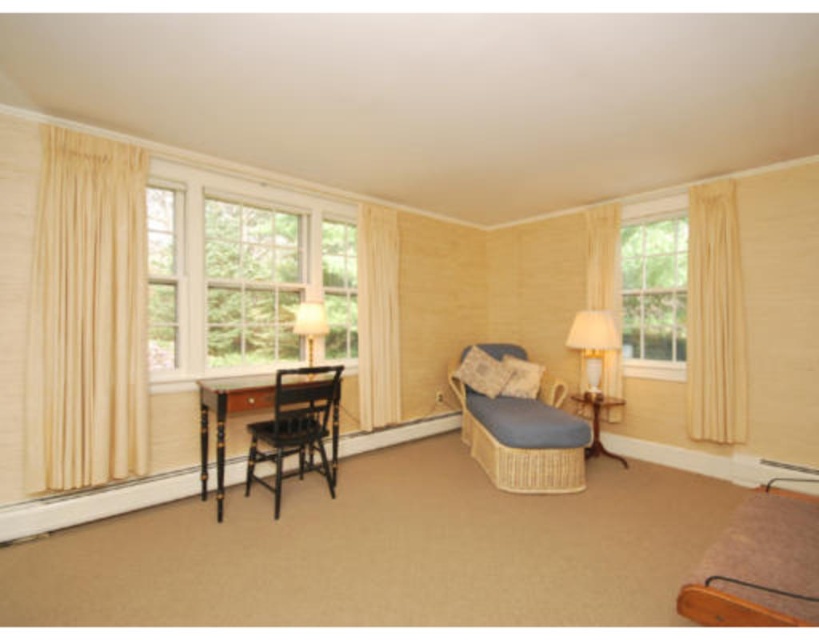
Is beige fabric curtain at right bigger than white glossy lampshade at upper center?

Yes.

Is beige fabric curtain at right to the left of white glossy lampshade at upper center from the viewer's perspective?

Incorrect, beige fabric curtain at right is not on the left side of white glossy lampshade at upper center.

At what (x,y) coordinates should I click in order to perform the action: click on beige fabric curtain at right. Please return your answer as a coordinate pair (x, y). This screenshot has height=640, width=819. Looking at the image, I should click on (713, 316).

Can you confirm if white wood window at center is positioned above white glossy table lamp at right?

Indeed, white wood window at center is positioned over white glossy table lamp at right.

Can you confirm if white wood window at center is positioned to the left of white glossy table lamp at right?

Correct, you'll find white wood window at center to the left of white glossy table lamp at right.

Between point (170, 362) and point (609, 314), which one is positioned in front?

Point (170, 362)

Identify the location of white wood window at center. pyautogui.click(x=242, y=273).

Does beige fabric curtain at right appear over clear glass window at upper left?

No.

Between beige fabric curtain at right and clear glass window at upper left, which one has more height?

Standing taller between the two is beige fabric curtain at right.

What do you see at coordinates (713, 316) in the screenshot? I see `beige fabric curtain at right` at bounding box center [713, 316].

Identify the location of beige fabric curtain at right. Image resolution: width=819 pixels, height=640 pixels. (713, 316).